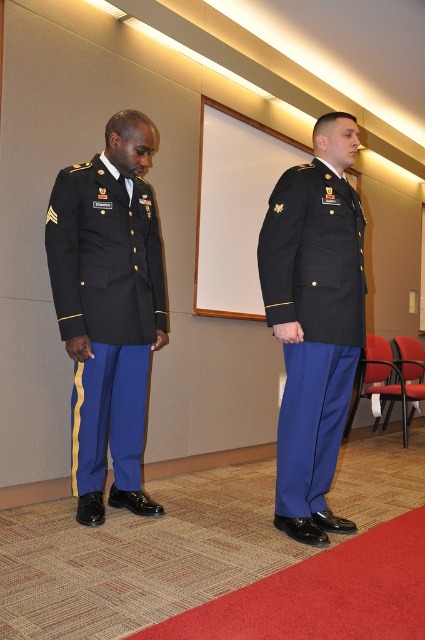
From the picture: Which is more to the left, matte black uniform at left or matte black uniform at center?

matte black uniform at left is more to the left.

Can you confirm if matte black uniform at left is shorter than matte black uniform at center?

Yes.

Is point (112, 259) closer to viewer compared to point (289, 404)?

No, it is behind (289, 404).

You are a GUI agent. You are given a task and a screenshot of the screen. Output one action in this format:
    pyautogui.click(x=<x>, y=<y>)
    Task: Click on the matte black uniform at left
    
    Given the screenshot: What is the action you would take?
    pyautogui.click(x=105, y=312)